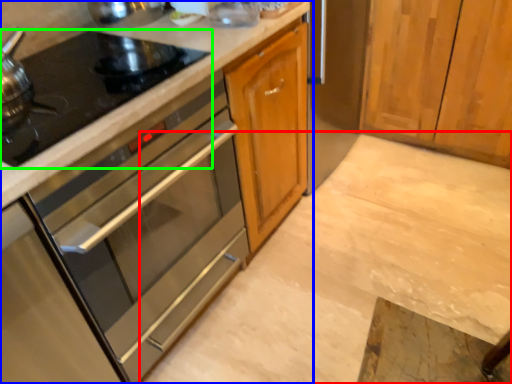
Question: Which object is the closest to the concrete (highlighted by a red box)? Choose among these: cabinetry (highlighted by a blue box) or gas stove (highlighted by a green box).

Choices:
 (A) cabinetry
 (B) gas stove

Answer: (A)